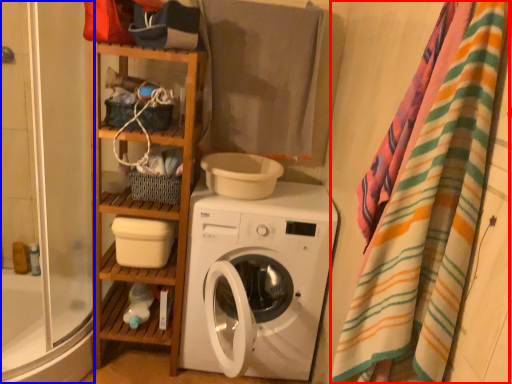
Question: Which object appears farthest to the camera in this image, blanket (highlighted by a red box) or shower door (highlighted by a blue box)?

Choices:
 (A) blanket
 (B) shower door

Answer: (B)